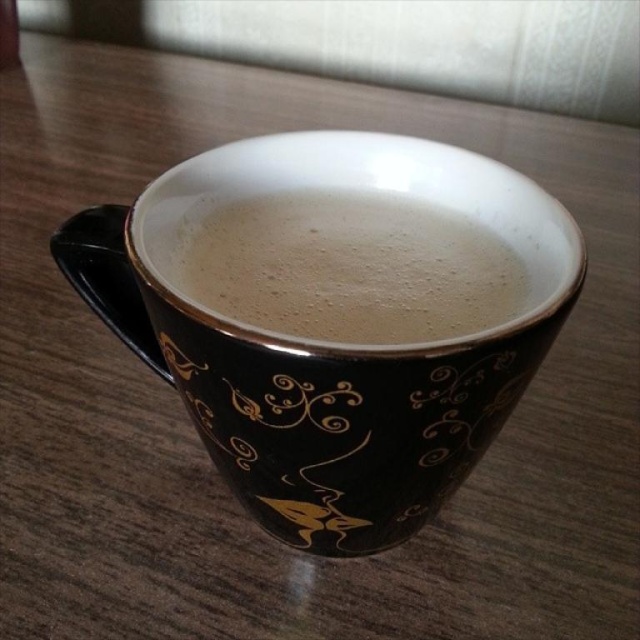
Question: Which point appears closest to the camera in this image?

Choices:
 (A) (252, 420)
 (B) (364, 336)

Answer: (A)

Question: Which of the following is the farthest from the observer?

Choices:
 (A) (470, 401)
 (B) (296, 304)

Answer: (B)

Question: Which point appears farthest from the camera in this image?

Choices:
 (A) (330, 522)
 (B) (362, 248)

Answer: (B)

Question: Does black ceramic mug at center have a larger size compared to white frothy coffee at center?

Choices:
 (A) no
 (B) yes

Answer: (B)

Question: Does black ceramic mug at center have a greater width compared to white frothy coffee at center?

Choices:
 (A) no
 (B) yes

Answer: (B)

Question: Is black ceramic mug at center wider than white frothy coffee at center?

Choices:
 (A) yes
 (B) no

Answer: (A)